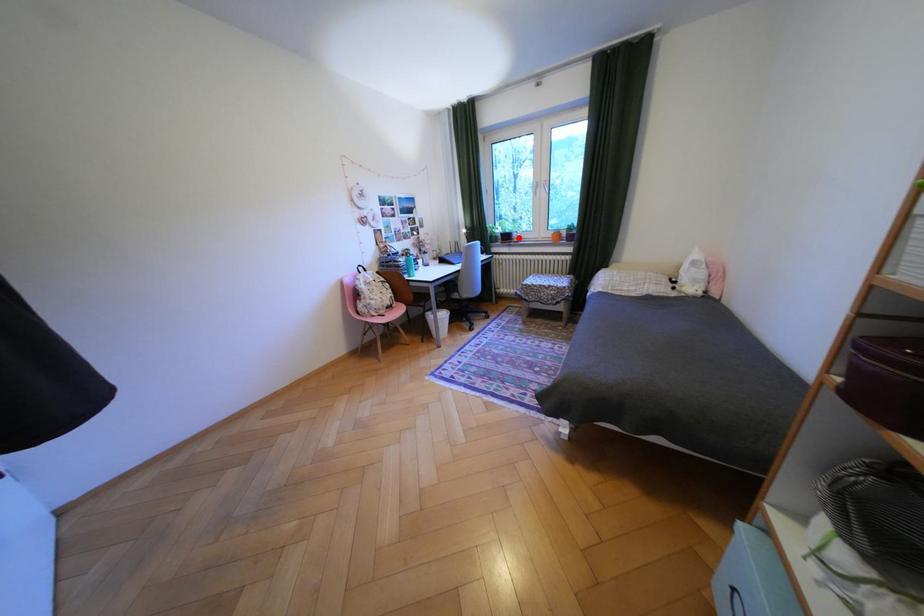
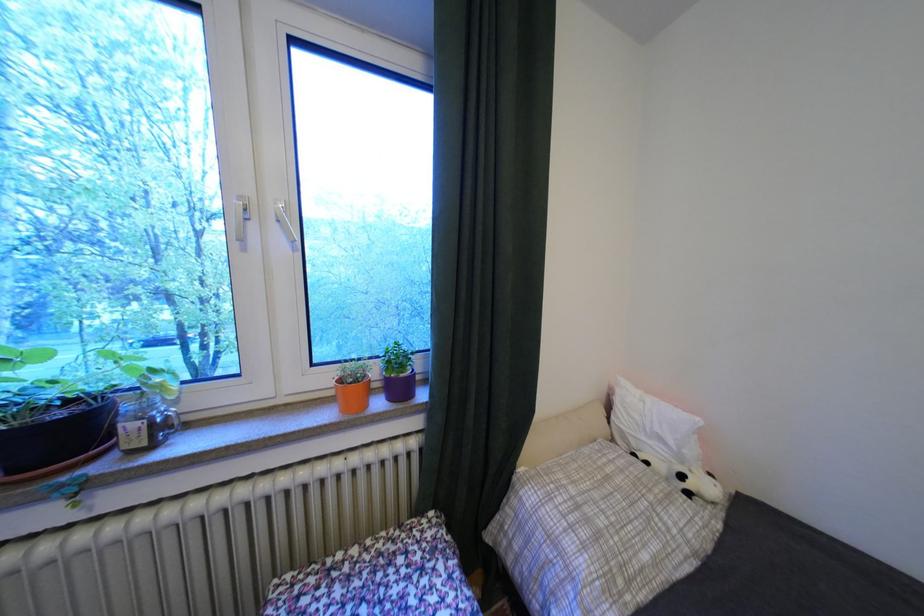
Question: A red point is marked in image1. In image2, is the corresponding 3D point closer to the camera or farther? Reply with the corresponding letter.

Choices:
 (A) The corresponding 3D point is closer.
 (B) The corresponding 3D point is farther.

Answer: (B)